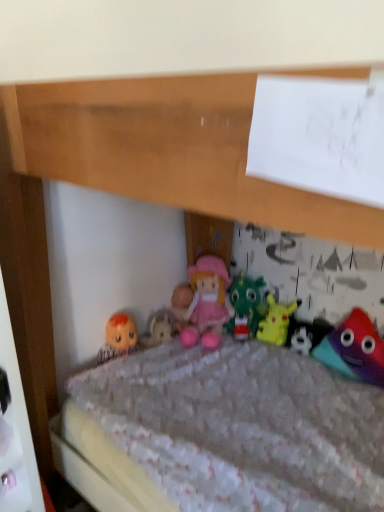
Question: From a real-world perspective, is pink fabric doll at center located higher than white plush toy at center, placed as the 2th toy when sorted from right to left?

Choices:
 (A) no
 (B) yes

Answer: (B)

Question: Is pink fabric doll at center positioned with its back to white plush toy at center, the 3th toy when ordered from left to right?

Choices:
 (A) yes
 (B) no

Answer: (B)

Question: From a real-world perspective, is pink fabric doll at center located beneath white plush toy at center, the 3th toy when ordered from left to right?

Choices:
 (A) yes
 (B) no

Answer: (B)

Question: From the image's perspective, does pink fabric doll at center appear higher than white plush toy at center, placed as the 2th toy when sorted from right to left?

Choices:
 (A) no
 (B) yes

Answer: (B)

Question: Can we say pink fabric doll at center lies outside white plush toy at center, the 3th toy when ordered from left to right?

Choices:
 (A) no
 (B) yes

Answer: (B)

Question: Would you say white plush toy at center, the 3th toy when ordered from left to right, is to the left or to the right of pink fabric doll at center in the picture?

Choices:
 (A) right
 (B) left

Answer: (A)

Question: In terms of width, does white plush toy at center, the 3th toy when ordered from left to right, look wider or thinner when compared to pink fabric doll at center?

Choices:
 (A) thin
 (B) wide

Answer: (A)

Question: From the image's perspective, is white plush toy at center, placed as the 2th toy when sorted from right to left, positioned above or below pink fabric doll at center?

Choices:
 (A) above
 (B) below

Answer: (B)

Question: Is white plush toy at center, placed as the 2th toy when sorted from right to left, in front of or behind pink fabric doll at center in the image?

Choices:
 (A) front
 (B) behind

Answer: (A)

Question: In terms of width, does white plush toy at center, the 3th toy when ordered from left to right, look wider or thinner when compared to pink fabric doll at center, placed as the fourth toy when sorted from right to left?

Choices:
 (A) wide
 (B) thin

Answer: (B)

Question: Is white plush toy at center, the 3th toy when ordered from left to right, taller or shorter than pink fabric doll at center, placed as the fourth toy when sorted from right to left?

Choices:
 (A) tall
 (B) short

Answer: (B)

Question: Is white plush toy at center, the 3th toy when ordered from left to right, in front of or behind pink fabric doll at center, placed as the fourth toy when sorted from right to left, in the image?

Choices:
 (A) behind
 (B) front

Answer: (B)

Question: Looking at the image, does white plush toy at center, the 3th toy when ordered from left to right, seem bigger or smaller compared to pink fabric doll at center, placed as the fourth toy when sorted from right to left?

Choices:
 (A) small
 (B) big

Answer: (A)

Question: Is pink fabric doll at center, placed as the fourth toy when sorted from right to left, wider or thinner than white plush toy at center, placed as the 2th toy when sorted from right to left?

Choices:
 (A) thin
 (B) wide

Answer: (B)

Question: In terms of height, does pink fabric doll at center, positioned as the 1th toy in left-to-right order, look taller or shorter compared to white plush toy at center, the 3th toy when ordered from left to right?

Choices:
 (A) short
 (B) tall

Answer: (B)